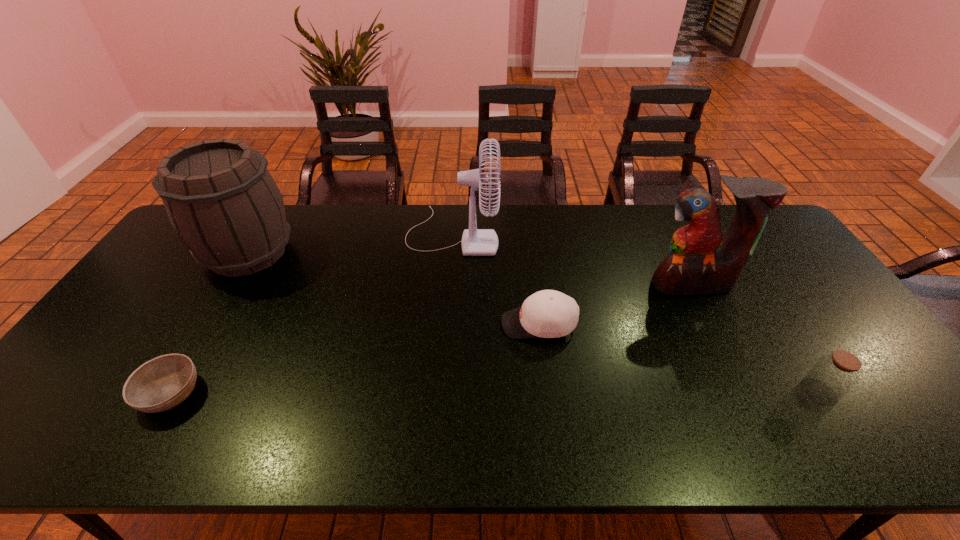
Find the location of a particular element. Image resolution: width=960 pixels, height=540 pixels. object that is positioned at the far left corner is located at coordinates (220, 198).

The image size is (960, 540). In the image, there is a desktop. In order to click on blank space at the far edge in this screenshot , I will do `click(399, 232)`.

The height and width of the screenshot is (540, 960). In the image, there is a desktop. What are the coordinates of `vacant space at the near edge` in the screenshot? It's located at (772, 431).

What are the coordinates of `vacant space at the left edge of the desktop` in the screenshot? It's located at (54, 416).

This screenshot has height=540, width=960. In the image, there is a desktop. Find the location of `vacant space at the right edge`. vacant space at the right edge is located at coordinates (764, 274).

Locate an element on the screen. The width and height of the screenshot is (960, 540). vacant space at the near left corner is located at coordinates (76, 427).

The image size is (960, 540). Identify the location of vacant region at the near right corner of the desktop. (899, 448).

I want to click on unoccupied position between the baseball cap and the parrot, so click(x=615, y=304).

Find the location of `blank region between the wine bucket and the fan`. blank region between the wine bucket and the fan is located at coordinates (350, 243).

The height and width of the screenshot is (540, 960). Identify the location of free spot between the jar and the third nearest object. (679, 358).